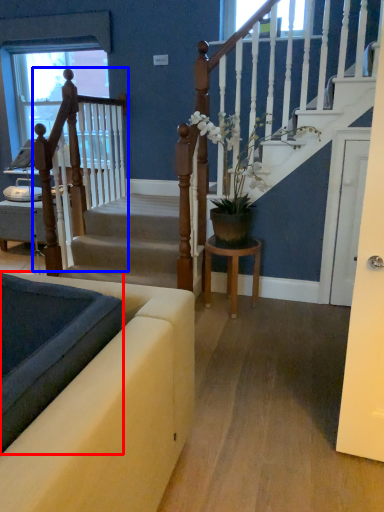
Question: Among these objects, which one is farthest to the camera, landing (highlighted by a red box) or rail (highlighted by a blue box)?

Choices:
 (A) landing
 (B) rail

Answer: (B)